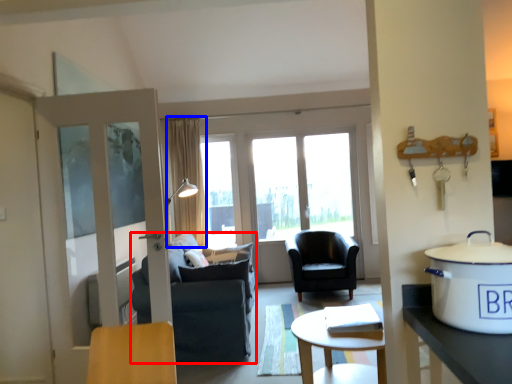
Question: Among these objects, which one is nearest to the camera, chair (highlighted by a red box) or curtain (highlighted by a blue box)?

Choices:
 (A) chair
 (B) curtain

Answer: (A)